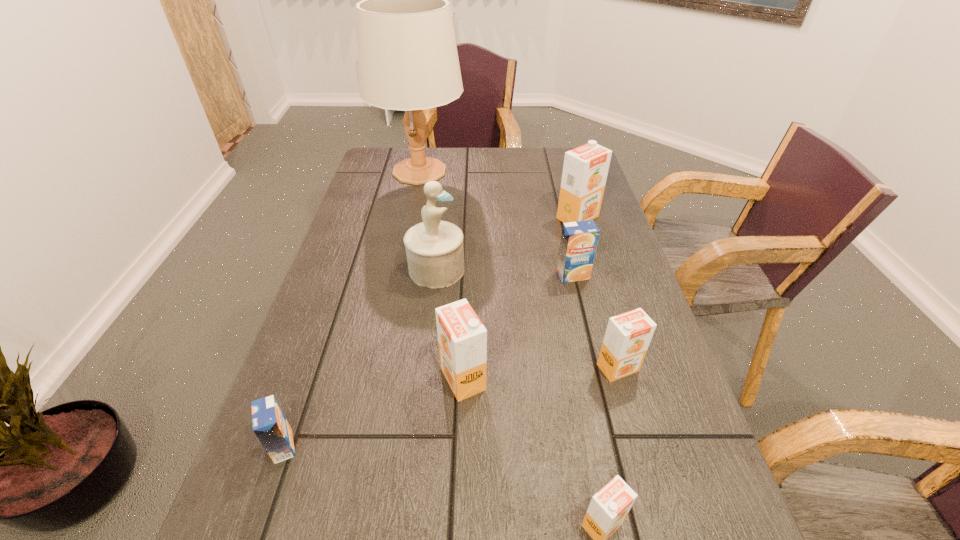
Find the location of `the nearer blue orange_juice`. the nearer blue orange_juice is located at coordinates (269, 424).

This screenshot has height=540, width=960. In order to click on the left blue orange_juice in this screenshot , I will do `click(269, 424)`.

Identify the location of free space located on the right of the table lamp. This screenshot has width=960, height=540. (519, 171).

At what (x,y) coordinates should I click in order to perform the action: click on free space located 0.120m at the beak of the white figurine. Please return your answer as a coordinate pair (x, y). This screenshot has height=540, width=960. Looking at the image, I should click on (513, 269).

Locate an element on the screen. Image resolution: width=960 pixels, height=540 pixels. free location located on the back of the farthest orange juice is located at coordinates (564, 167).

Where is `vacant area situated 0.100m on the left of the leftmost orange orange juice`? This screenshot has height=540, width=960. vacant area situated 0.100m on the left of the leftmost orange orange juice is located at coordinates (388, 379).

Identify the location of vacant space located on the left of the right blue orange_juice. pyautogui.click(x=479, y=275).

At what (x,y) coordinates should I click in order to perform the action: click on vacant space positioned 0.160m on the front of the second smallest orange orange juice. Please return your answer as a coordinate pair (x, y). This screenshot has width=960, height=540. Looking at the image, I should click on (645, 464).

Locate an element on the screen. Image resolution: width=960 pixels, height=540 pixels. free spot located on the right of the smaller blue orange_juice is located at coordinates (497, 447).

Find the location of a particular element. The width and height of the screenshot is (960, 540). object situated at the far edge is located at coordinates (407, 55).